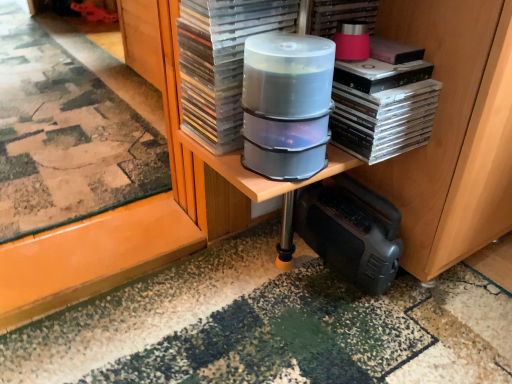
Image resolution: width=512 pixels, height=384 pixels. Find the location of `free point to the left of black plastic speaker at lower right, acting as the 1th appliance starting from the back`. free point to the left of black plastic speaker at lower right, acting as the 1th appliance starting from the back is located at coordinates (271, 278).